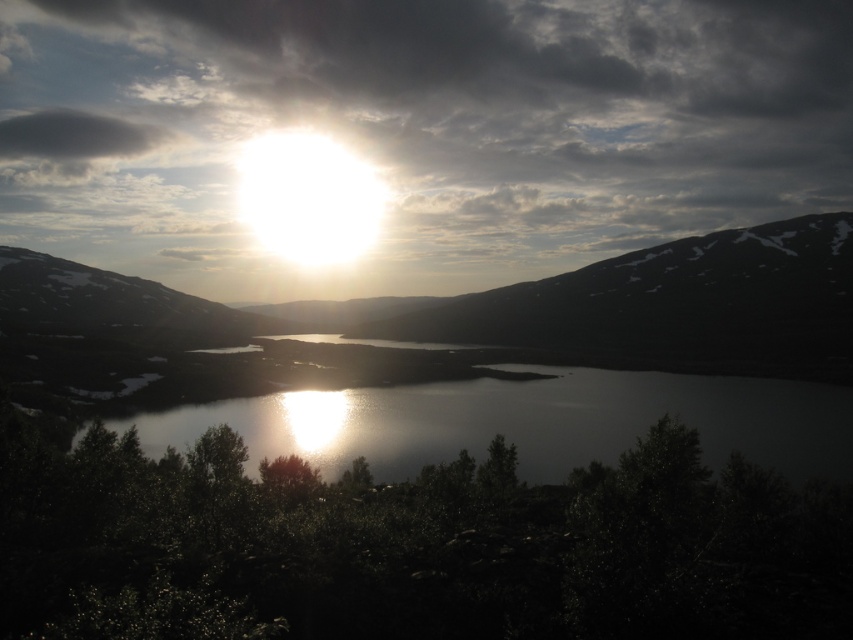
Is dark gray rocky mountain at center thinner than glistening reflective water at center?

No, dark gray rocky mountain at center is not thinner than glistening reflective water at center.

In the scene shown: Is dark gray rocky mountain at center to the left of glistening reflective water at center from the viewer's perspective?

Indeed, dark gray rocky mountain at center is positioned on the left side of glistening reflective water at center.

Does point (662, 282) come closer to viewer compared to point (561, 429)?

That is False.

Find the location of `dark gray rocky mountain at center`. dark gray rocky mountain at center is located at coordinates click(x=672, y=305).